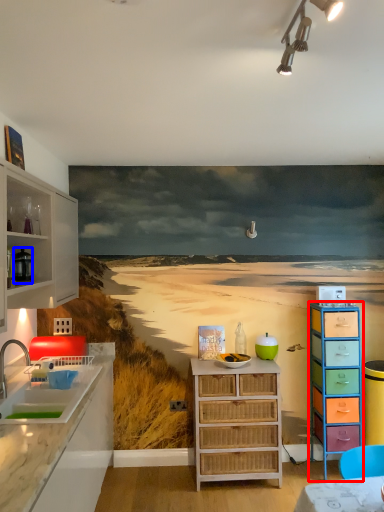
Question: Among these objects, which one is nearest to the camera, chest of drawers (highlighted by a red box) or appliance (highlighted by a blue box)?

Choices:
 (A) chest of drawers
 (B) appliance

Answer: (B)